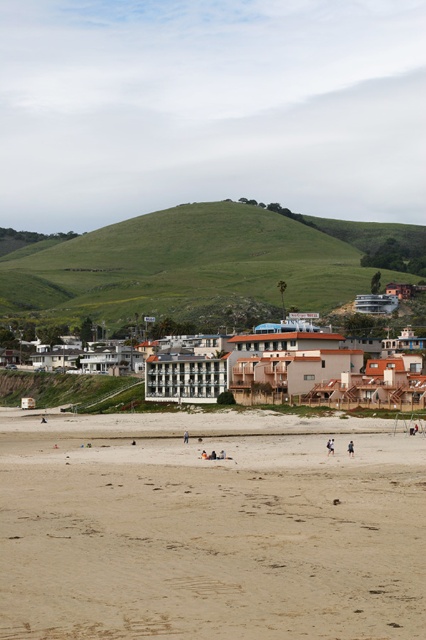
Question: Which object is the closest to the light brown sand at center?

Choices:
 (A) white stucco buildings at center
 (B) light brown wooden surfboard at center
 (C) light blue fabric at center

Answer: (C)

Question: Can you confirm if green grassy hillside at upper center is wider than white stucco buildings at center?

Choices:
 (A) no
 (B) yes

Answer: (B)

Question: Is light tan sand at lower center to the right of white concrete building at center from the viewer's perspective?

Choices:
 (A) no
 (B) yes

Answer: (B)

Question: Which object is the closest to the white concrete building at center?

Choices:
 (A) light brown wooden surfboard at center
 (B) white stucco buildings at center
 (C) light brown sand at center

Answer: (B)

Question: Which object is farther from the camera taking this photo?

Choices:
 (A) light tan sand at lower center
 (B) white concrete building at center

Answer: (B)

Question: Does light blue fabric at center lie in front of light brown wooden surfboard at center?

Choices:
 (A) no
 (B) yes

Answer: (B)